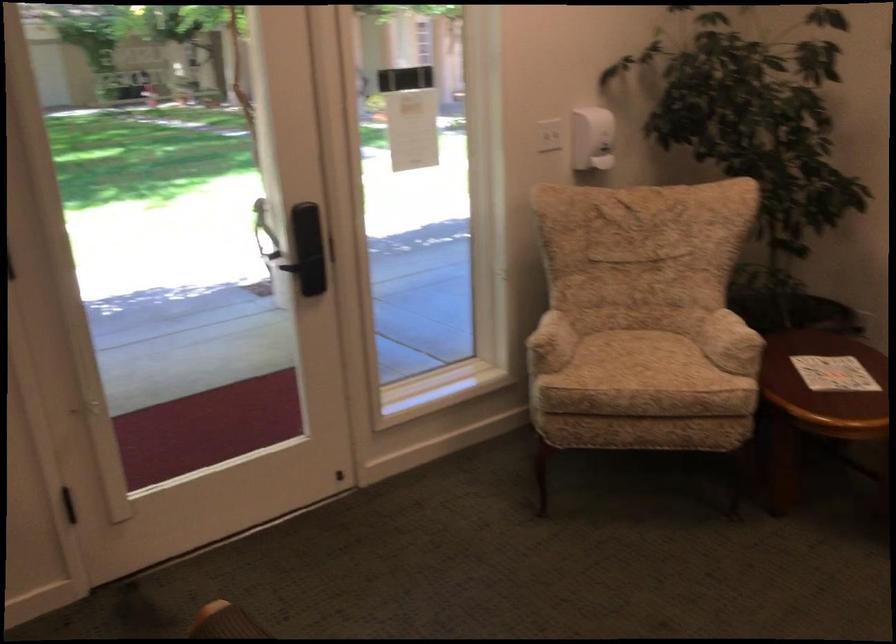
You are a GUI agent. You are given a task and a screenshot of the screen. Output one action in this format:
    pyautogui.click(x=<x>, y=<y>)
    Task: Click on the black door handle
    The width and height of the screenshot is (896, 644).
    Given the screenshot: What is the action you would take?
    pyautogui.click(x=308, y=269)